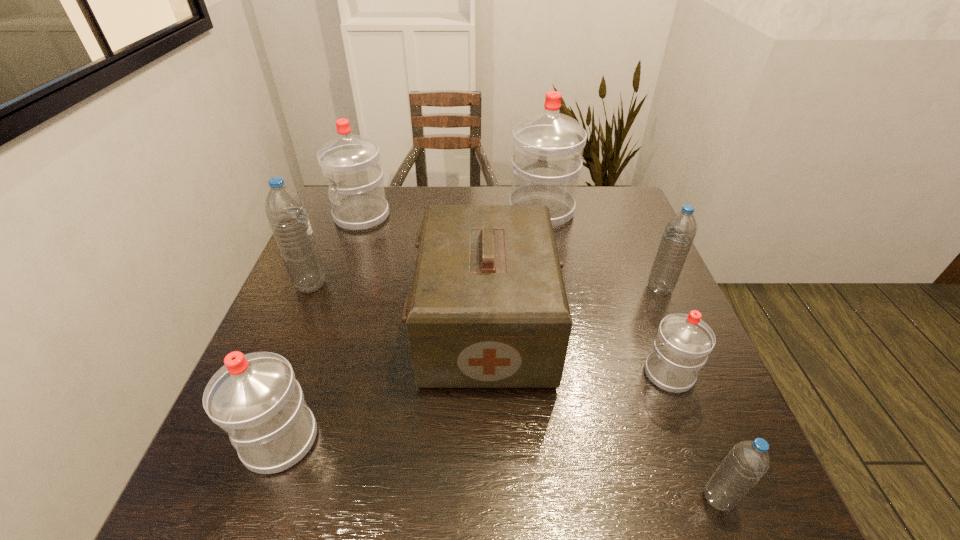
Select which blue water bottle is the second closest to the second biggest blue water bottle. Please provide its 2D coordinates. Your answer should be formatted as a tuple, i.e. [(x, y)], where the tuple contains the x and y coordinates of a point satisfying the conditions above.

[(286, 213)]

Locate an element on the screen. The height and width of the screenshot is (540, 960). vacant region that satisfies the following two spatial constraints: 1. on the handle side of the sixth farthest water bottle; 2. on the back side of the nearest blue water bottle is located at coordinates (259, 498).

Identify the location of free space that satisfies the following two spatial constraints: 1. on the back side of the nearest blue water bottle; 2. on the handle side of the nearest white water bottle. This screenshot has height=540, width=960. (695, 440).

I want to click on vacant space that satisfies the following two spatial constraints: 1. on the front side of the second biggest blue water bottle; 2. on the left side of the biggest blue water bottle, so point(309,288).

This screenshot has width=960, height=540. I want to click on vacant space that satisfies the following two spatial constraints: 1. on the back side of the red first-aid kit; 2. on the handle side of the second biggest white water bottle, so click(485, 217).